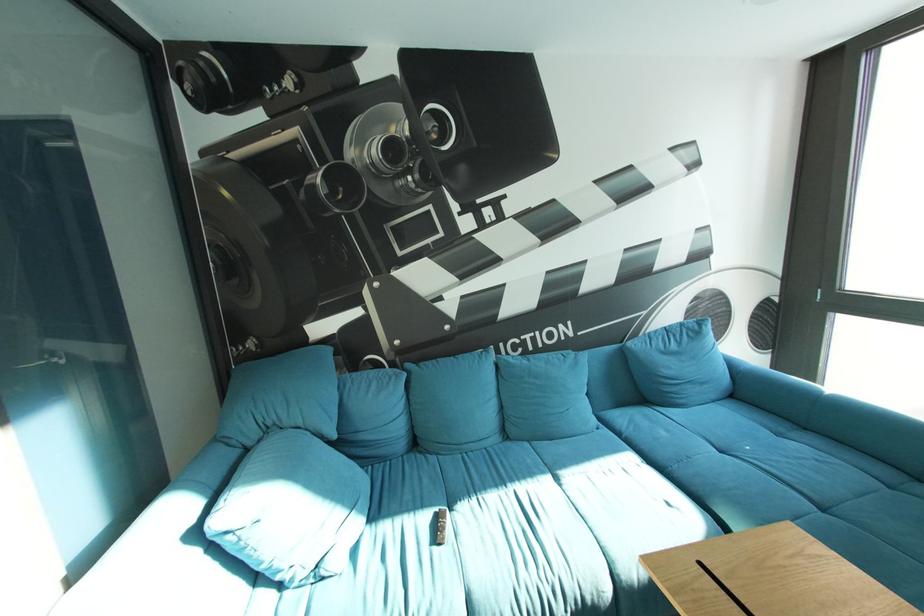
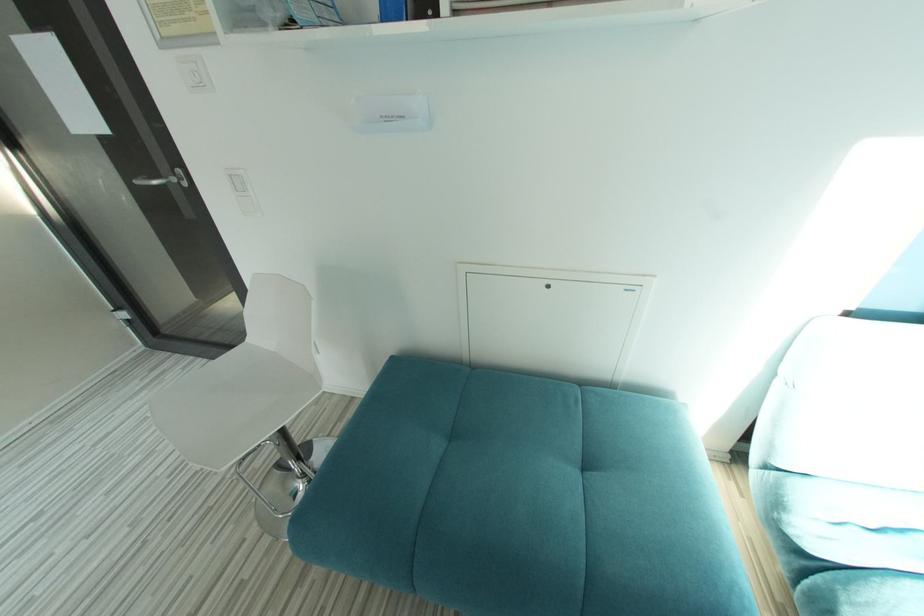
The first image is from the beginning of the video and the second image is from the end. How did the camera likely rotate when shooting the video?

The camera rotated toward left-down.